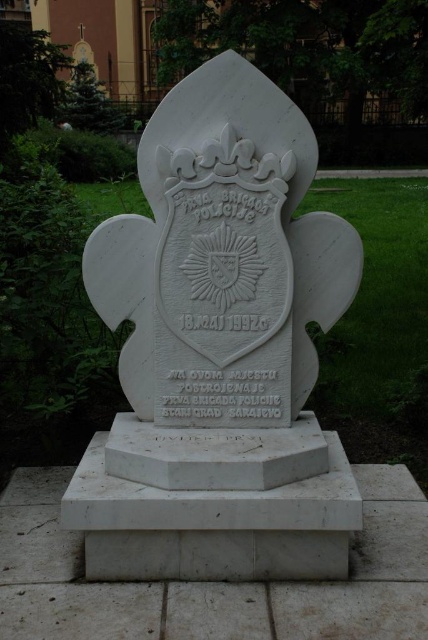
You are a surveyor measuring distances on the monument. You have two points marked on the monument, point (172, 538) and point (284, 540). Which point is nearer to your position?

Point (172, 538) is closer to the viewer than point (284, 540).

You are a visitor at the park and see the white marble monument at center. There is a point marked at coordinates (219,348). Can you tell me where exactly this point is located on the monument?

The point (219,348) is located on the white marble monument at center.